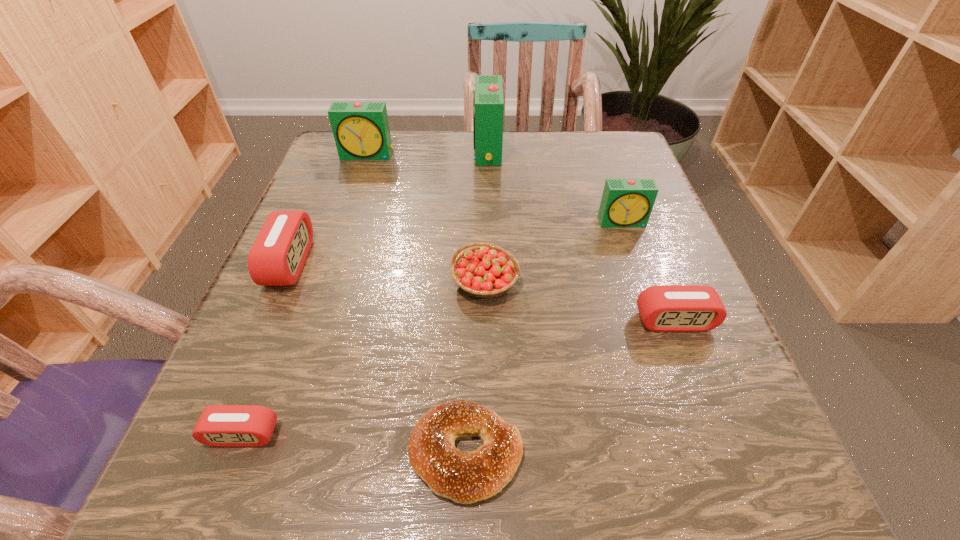
Where is `vacant space that's between the smallest pink alarm clock and the second smallest pink alarm clock`? The width and height of the screenshot is (960, 540). vacant space that's between the smallest pink alarm clock and the second smallest pink alarm clock is located at coordinates (459, 377).

This screenshot has width=960, height=540. I want to click on vacant space that's between the strawberry and the tallest object, so click(x=486, y=216).

The width and height of the screenshot is (960, 540). Find the location of `free space between the strawberry and the fourth alarm clock from left to right`. free space between the strawberry and the fourth alarm clock from left to right is located at coordinates (486, 216).

This screenshot has width=960, height=540. What are the coordinates of `object that stands as the seventh closest to the brown bagel` in the screenshot? It's located at (361, 131).

Identify which object is located as the seventh nearest to the bagel. Please provide its 2D coordinates. Your answer should be formatted as a tuple, i.e. [(x, y)], where the tuple contains the x and y coordinates of a point satisfying the conditions above.

[(361, 131)]

The image size is (960, 540). What are the coordinates of `alarm clock that is the fourth closest one to the nearest green alarm clock` in the screenshot? It's located at (277, 256).

Identify which alarm clock is located as the fourth nearest to the second tallest alarm clock. Please provide its 2D coordinates. Your answer should be formatted as a tuple, i.e. [(x, y)], where the tuple contains the x and y coordinates of a point satisfying the conditions above.

[(666, 308)]

Locate which green alarm clock ranks third in proximity to the shortest alarm clock. Please provide its 2D coordinates. Your answer should be formatted as a tuple, i.e. [(x, y)], where the tuple contains the x and y coordinates of a point satisfying the conditions above.

[(488, 102)]

Select which green alarm clock appears as the second closest to the nearest alarm clock. Please provide its 2D coordinates. Your answer should be formatted as a tuple, i.e. [(x, y)], where the tuple contains the x and y coordinates of a point satisfying the conditions above.

[(361, 131)]

Where is `pink alarm clock that is the closest one to the fourth shortest alarm clock`? This screenshot has height=540, width=960. pink alarm clock that is the closest one to the fourth shortest alarm clock is located at coordinates (666, 308).